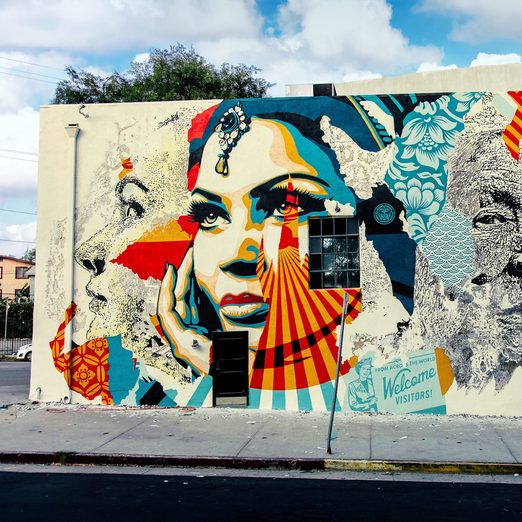
Identify the location of black and white sketch on mural. (512, 240).